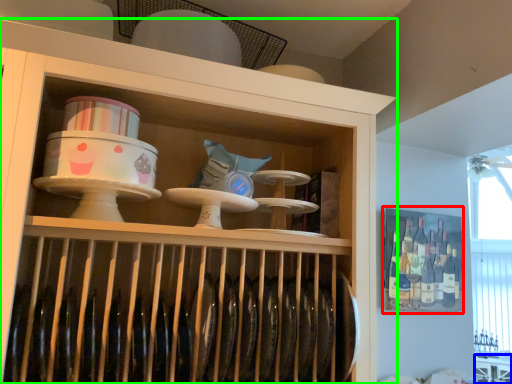
Question: Which object is the farthest from cabinet (highlighted by a red box)? Choose among these: table (highlighted by a blue box) or shelf (highlighted by a green box).

Choices:
 (A) table
 (B) shelf

Answer: (B)